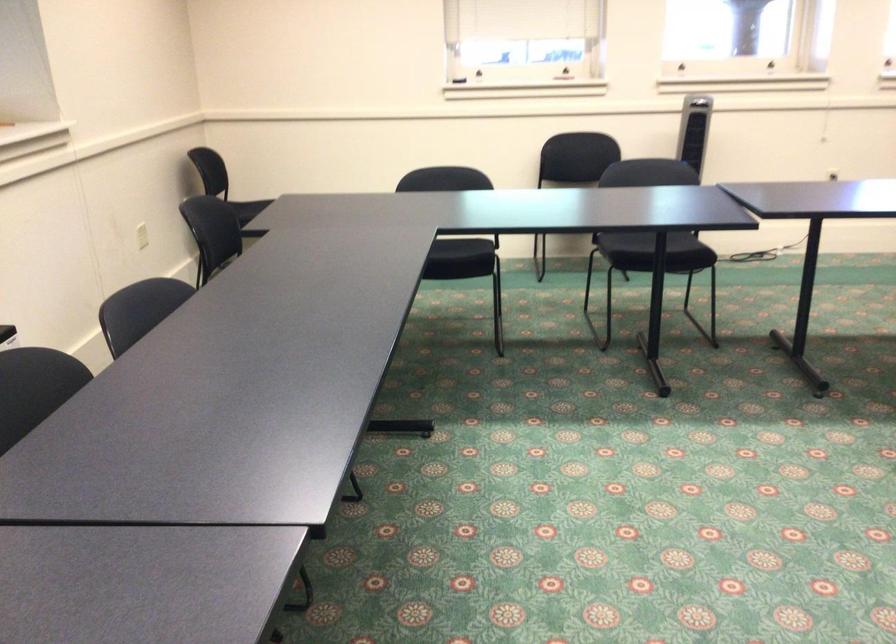
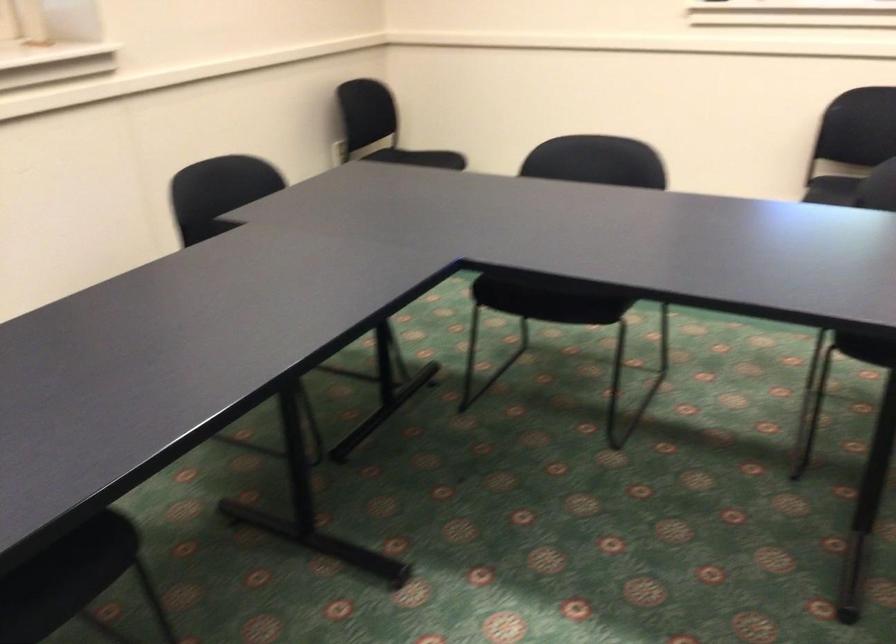
Which direction would the cameraman need to move to produce the second image?

The cameraman walked toward right, forward.